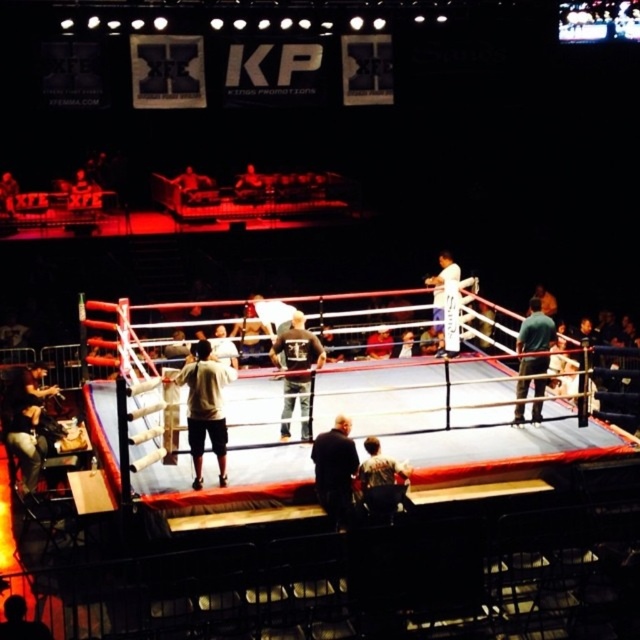
You are a photographer positioned at the edge of the boxing ring. You need to capture a photo of both the dark gray sweatshirt at center and the green fabric shirt at center. Which clothing item will appear taller in the photo?

The green fabric shirt at center will appear taller in the photo because it is taller than the dark gray sweatshirt at center according to the description.

You are a photographer positioned at the back of the arena. You want to take a photo that includes both the dark brown leather jacket at center and the green fabric shirt at center. Which one will appear larger in your photo?

The dark brown leather jacket at center will appear larger in the photo because it is closer to the viewer than the green fabric shirt at center.

You are a photographer positioned at the edge of the boxing ring. You want to capture a photo of both the dark brown leather jacket at center and the dark gray sweatshirt at center in the same frame. Which clothing item will appear wider in the photo?

The dark gray sweatshirt at center will appear wider in the photo because it has a greater width than the dark brown leather jacket at center.